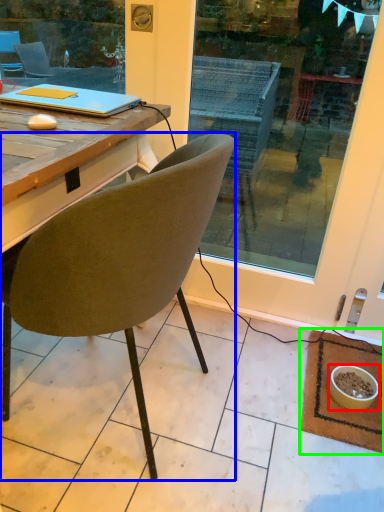
Question: Which is farther away from bowl (highlighted by a red box)? chair (highlighted by a blue box) or mat (highlighted by a green box)?

Choices:
 (A) chair
 (B) mat

Answer: (A)